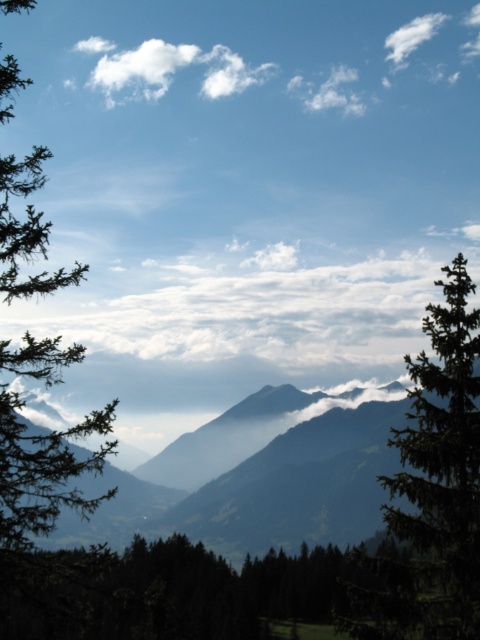
Between point (45, 276) and point (400, 58), which one is positioned in front?

Positioned in front is point (45, 276).

Is green matte tree at left wider than white fluffy cloud at upper right?

Yes.

Which is in front, point (9, 10) or point (416, 35)?

Positioned in front is point (9, 10).

Locate an element on the screen. green matte tree at left is located at coordinates (41, 448).

Is white fluffy cloud at upper left positioned before white fluffy cloud at upper right?

Yes.

Is the position of white fluffy cloud at upper left more distant than that of white fluffy cloud at upper right?

No, white fluffy cloud at upper left is closer to the viewer.

Is point (113, 88) behind point (409, 28)?

No, it is in front of (409, 28).

The image size is (480, 640). Find the location of `white fluffy cloud at upper left`. white fluffy cloud at upper left is located at coordinates (167, 68).

Describe the element at coordinates (431, 490) in the screenshot. The image size is (480, 640). I see `green textured tree at right` at that location.

At what (x,y) coordinates should I click in order to perform the action: click on green textured tree at right. Please return your answer as a coordinate pair (x, y). The width and height of the screenshot is (480, 640). Looking at the image, I should click on (431, 490).

You are a GUI agent. You are given a task and a screenshot of the screen. Output one action in this format:
    pyautogui.click(x=<x>, y=<y>)
    Task: Click on the green textured tree at right
    The image size is (480, 640).
    Given the screenshot: What is the action you would take?
    pyautogui.click(x=431, y=490)